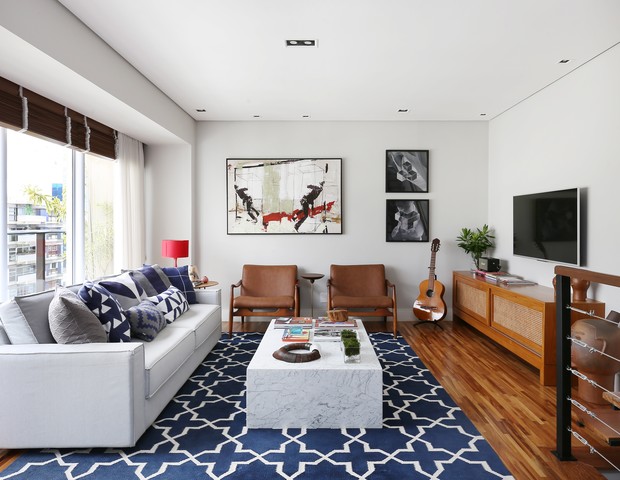
Locate an element on the screen. wood floor is located at coordinates (487, 421).